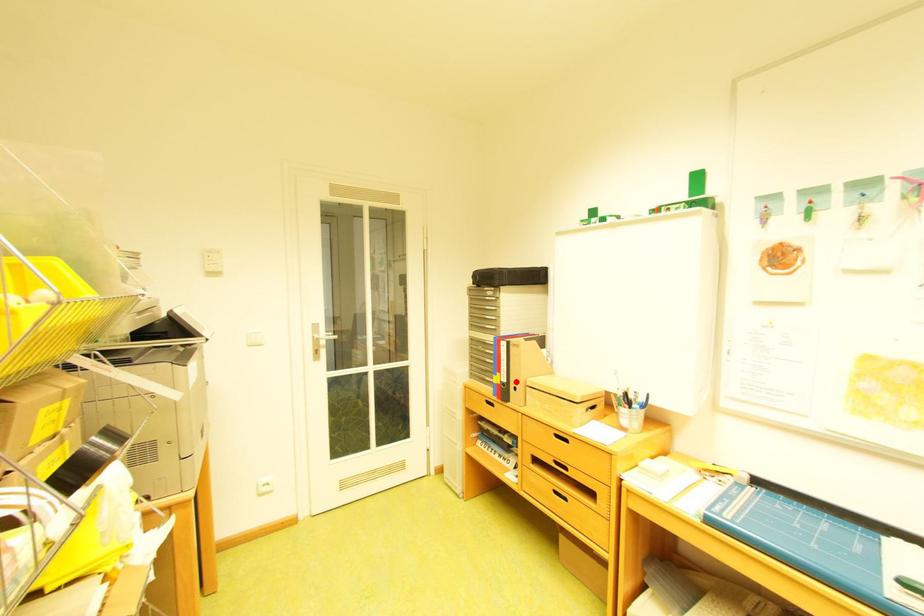
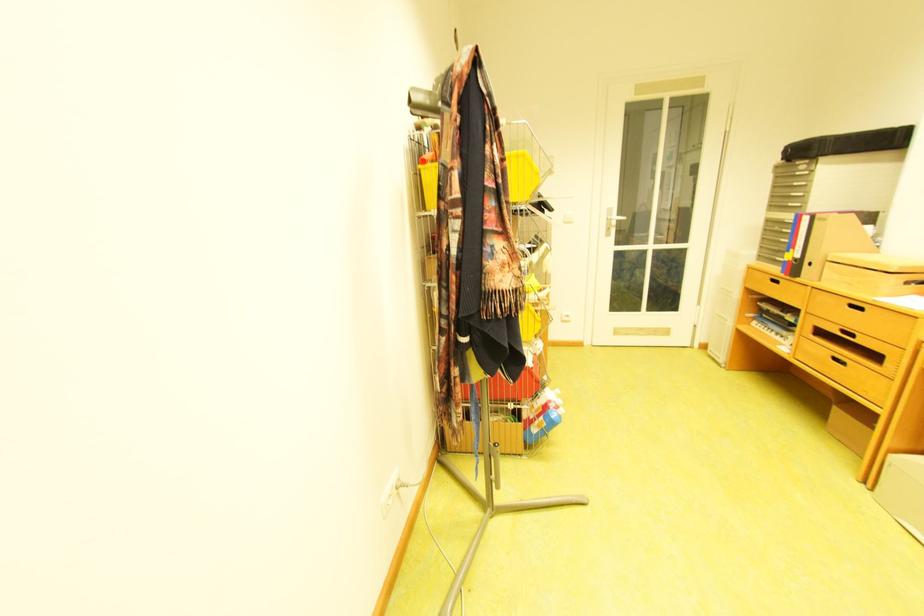
Locate, in the second image, the point that corresponds to the highlighted location in the first image.

(809, 257)